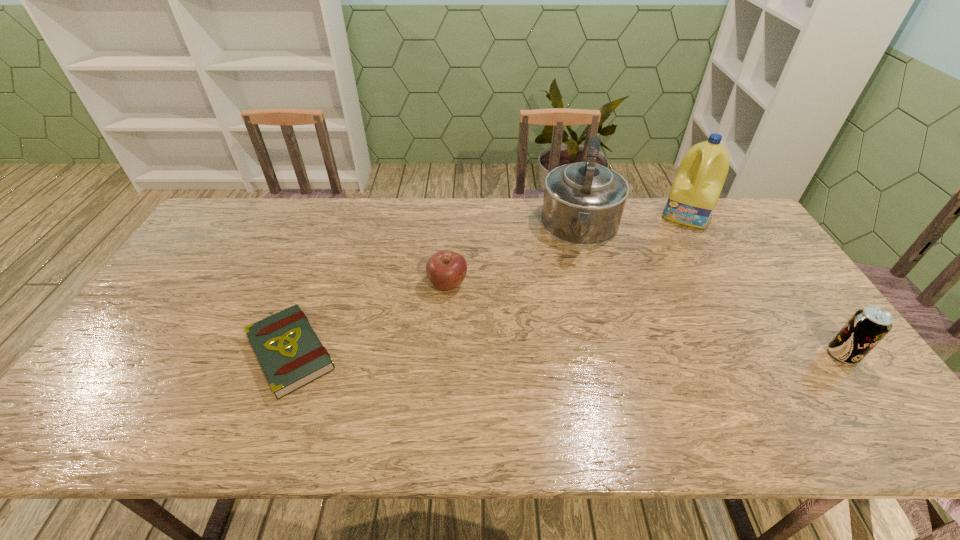
You are a GUI agent. You are given a task and a screenshot of the screen. Output one action in this format:
    pyautogui.click(x=<x>, y=<y>)
    Task: Click on the object that stands as the closest to the fourth object from left to right
    
    Given the screenshot: What is the action you would take?
    pyautogui.click(x=583, y=203)

The image size is (960, 540). Find the location of `free location that satisfies the following two spatial constraints: 1. on the back side of the detergent; 2. on the right side of the kettle`. free location that satisfies the following two spatial constraints: 1. on the back side of the detergent; 2. on the right side of the kettle is located at coordinates [578, 214].